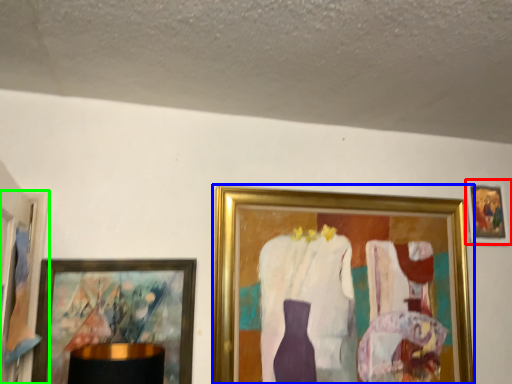
Question: Which object is the closest to the picture frame (highlighted by a red box)? Choose among these: picture frame (highlighted by a blue box) or picture frame (highlighted by a green box).

Choices:
 (A) picture frame
 (B) picture frame

Answer: (A)